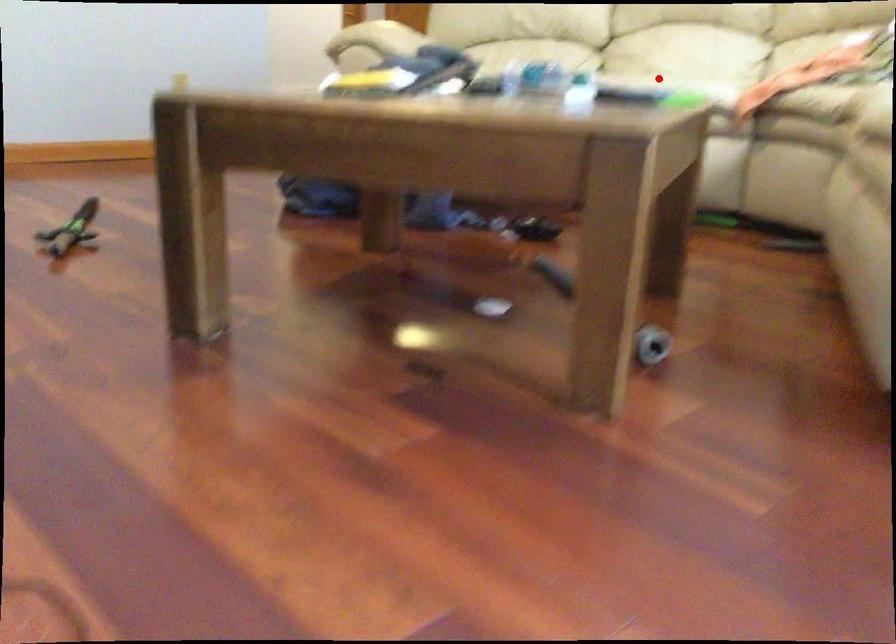
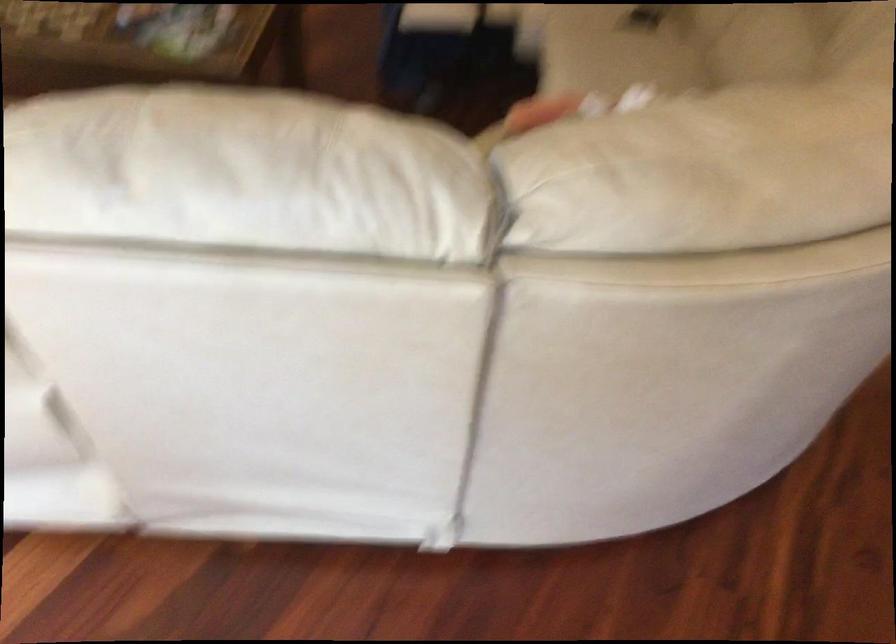
Question: A red point is marked in image1. In image2, is the corresponding 3D point closer to the camera or farther? Reply with the corresponding letter.

Choices:
 (A) The corresponding 3D point is closer.
 (B) The corresponding 3D point is farther.

Answer: (A)